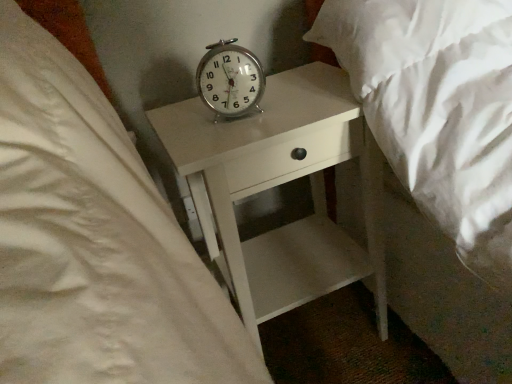
Where is `vacant space underneath white glossy nightstand at center (from a real-world perspective)`? vacant space underneath white glossy nightstand at center (from a real-world perspective) is located at coordinates click(x=307, y=333).